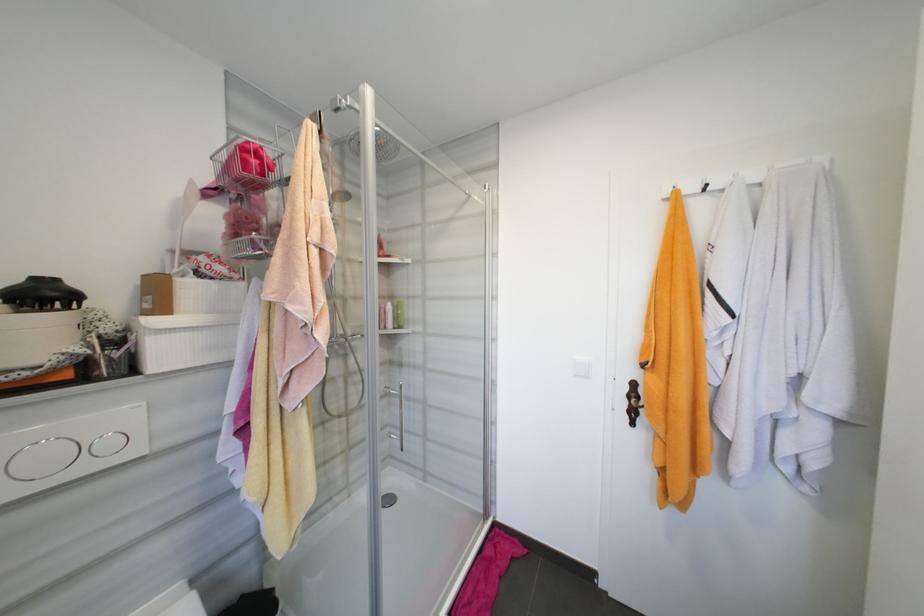
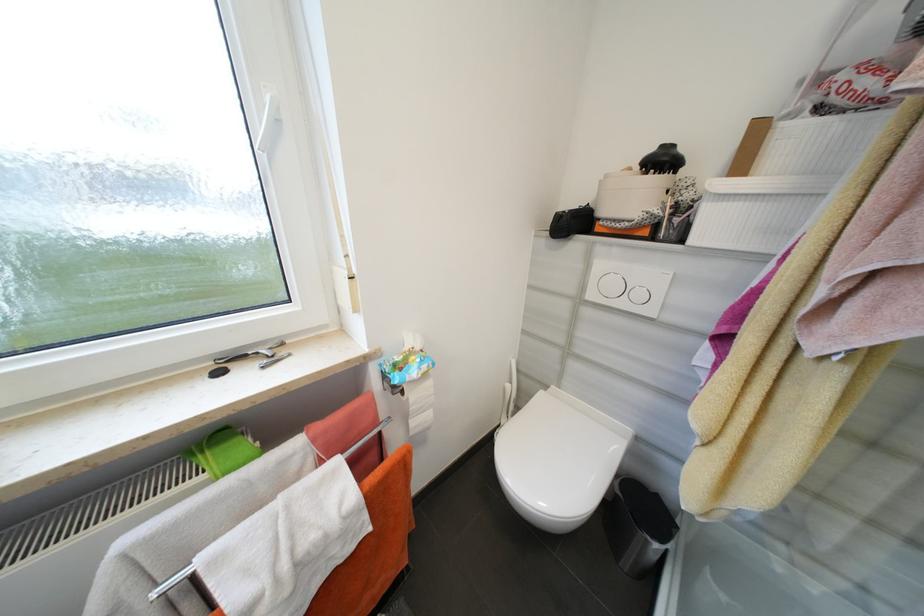
The point at (140, 371) is marked in the first image. Where is the corresponding point in the second image?

(687, 241)